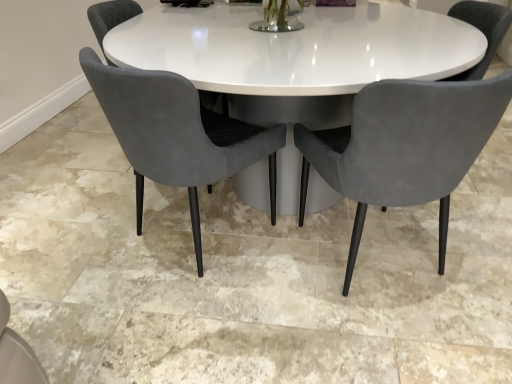
Question: Which direction should I rotate to face velvet grey chair at center, which ranks as the second chair in right-to-left order, — up or down?

Choices:
 (A) down
 (B) up

Answer: (B)

Question: From the image's perspective, is velvet grey chair at center, which ranks as the second chair in right-to-left order, over velvet grey chair at center, which is counted as the 1th chair, starting from the right?

Choices:
 (A) yes
 (B) no

Answer: (A)

Question: Are velvet grey chair at center, which ranks as the second chair in right-to-left order, and velvet grey chair at center, the 3th chair positioned from the left, beside each other?

Choices:
 (A) no
 (B) yes

Answer: (A)

Question: Can we say velvet grey chair at center, the 2th chair when ordered from left to right, lies outside velvet grey chair at center, which is counted as the 1th chair, starting from the right?

Choices:
 (A) no
 (B) yes

Answer: (B)

Question: Can you confirm if velvet grey chair at center, which ranks as the second chair in right-to-left order, is shorter than velvet grey chair at center, the 3th chair positioned from the left?

Choices:
 (A) yes
 (B) no

Answer: (A)

Question: Is velvet grey chair at center, which ranks as the second chair in right-to-left order, wider than velvet grey chair at center, the 3th chair positioned from the left?

Choices:
 (A) no
 (B) yes

Answer: (A)

Question: Considering the relative sizes of velvet grey chair at center, the 2th chair when ordered from left to right, and velvet grey chair at center, the 3th chair positioned from the left, in the image provided, is velvet grey chair at center, the 2th chair when ordered from left to right, taller than velvet grey chair at center, the 3th chair positioned from the left,?

Choices:
 (A) yes
 (B) no

Answer: (B)

Question: From the image's perspective, is velvet grey chair at center, the 2th chair when ordered from left to right, under velvet grey chair at center, the 1th chair positioned from the left?

Choices:
 (A) yes
 (B) no

Answer: (A)

Question: Is velvet grey chair at center, which ranks as the second chair in right-to-left order, next to velvet grey chair at center, arranged as the 3th chair when viewed from the right?

Choices:
 (A) no
 (B) yes

Answer: (A)

Question: Considering the relative positions of velvet grey chair at center, the 2th chair when ordered from left to right, and velvet grey chair at center, the 1th chair positioned from the left, in the image provided, is velvet grey chair at center, the 2th chair when ordered from left to right, to the right of velvet grey chair at center, the 1th chair positioned from the left, from the viewer's perspective?

Choices:
 (A) no
 (B) yes

Answer: (B)

Question: Does velvet grey chair at center, which ranks as the second chair in right-to-left order, have a smaller size compared to velvet grey chair at center, the 1th chair positioned from the left?

Choices:
 (A) yes
 (B) no

Answer: (A)

Question: From a real-world perspective, does velvet grey chair at center, which ranks as the second chair in right-to-left order, sit lower than velvet grey chair at center, arranged as the 3th chair when viewed from the right?

Choices:
 (A) no
 (B) yes

Answer: (B)

Question: Does velvet grey chair at center, the 2th chair when ordered from left to right, have a lesser height compared to velvet grey chair at center, arranged as the 3th chair when viewed from the right?

Choices:
 (A) yes
 (B) no

Answer: (B)

Question: Does velvet grey chair at center, the 1th chair positioned from the left, touch velvet grey chair at center, which is counted as the 1th chair, starting from the right?

Choices:
 (A) no
 (B) yes

Answer: (A)